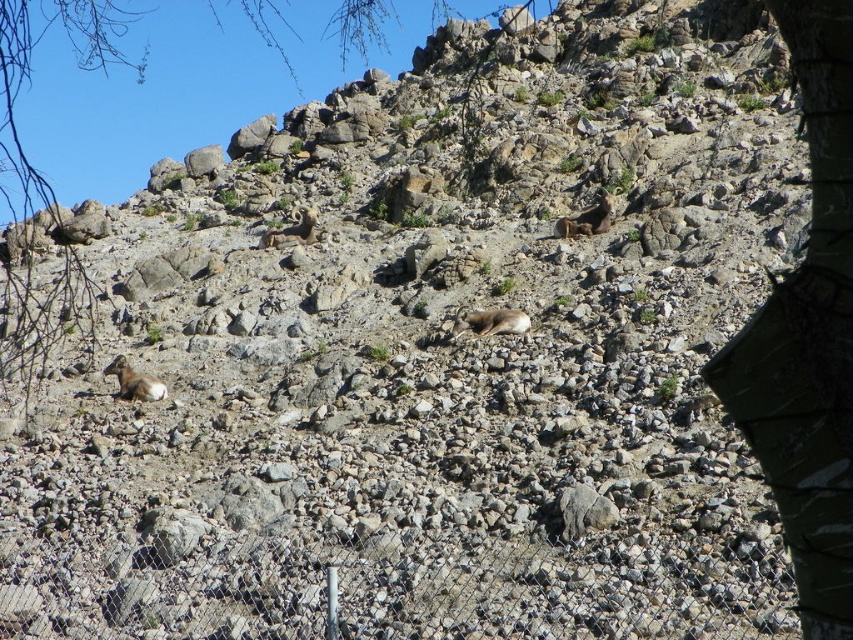
From the picture: Between white woolly goat at lower left and brown woolly sheep at upper center, which one is positioned higher?

brown woolly sheep at upper center is above.

Which is below, white woolly goat at lower left or brown woolly sheep at upper center?

Positioned lower is white woolly goat at lower left.

Identify the location of white woolly goat at lower left. This screenshot has width=853, height=640. (134, 381).

Who is higher up, white woolly sheep at center or white woolly goat at lower left?

Result: white woolly sheep at center

Which is in front, point (525, 332) or point (131, 388)?

Point (525, 332) is in front.

I want to click on white woolly sheep at center, so click(491, 323).

Is green leafy tree at upper center bigger than white woolly goat at lower left?

Indeed, green leafy tree at upper center has a larger size compared to white woolly goat at lower left.

Between point (9, 244) and point (132, 378), which one is positioned behind?

The point (9, 244) is behind.

Where is `green leafy tree at upper center`? The width and height of the screenshot is (853, 640). green leafy tree at upper center is located at coordinates (32, 72).